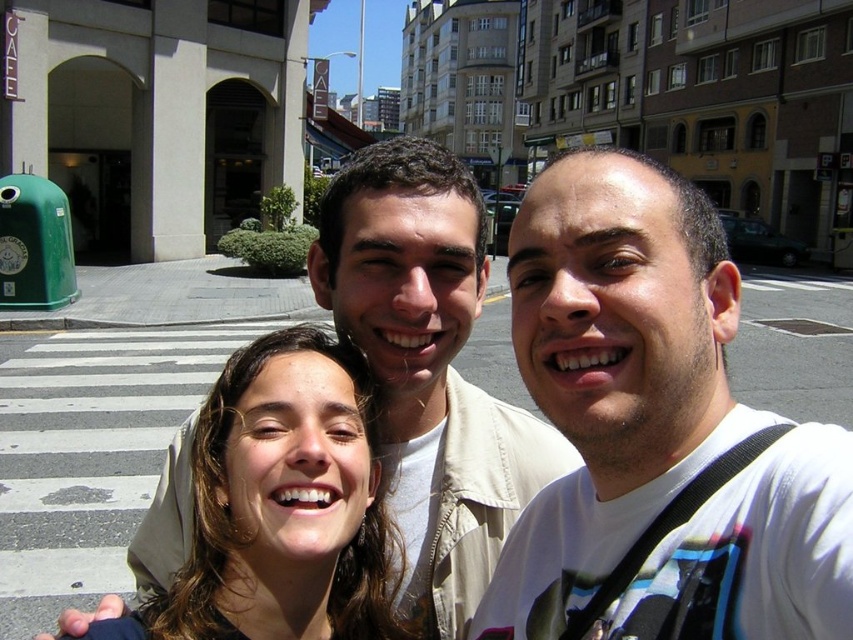
You are a photographer trying to frame a group photo of the three people in the selfie. You want to ensure that the white matte shirt at center and the brown hair at center are both visible in the frame. Which object should you adjust the camera angle to focus on first to ensure both are in the frame?

The white matte shirt at center is thinner than brown hair at center, so you should focus on the brown hair at center first to ensure both are in the frame.

You are a photographer trying to capture the best angle for a group photo. You notice the white matte shirt at center and the brown hair at center. Which one should you focus on to ensure the subject is in the foreground?

The white matte shirt at center is above the brown hair at center, so focusing on the white matte shirt at center would ensure the subject is in the foreground since it is positioned higher up.